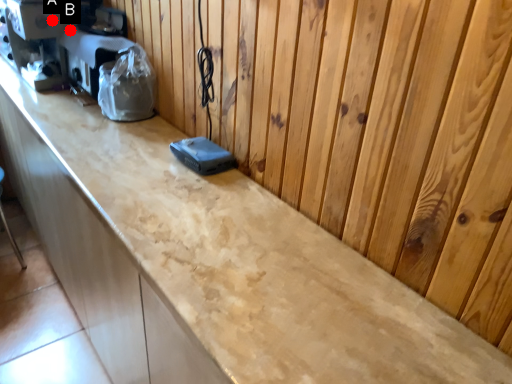
Question: Two points are circled on the image, labeled by A and B beside each circle. Which point appears farthest from the camera in this image?

Choices:
 (A) A is further
 (B) B is further

Answer: (B)